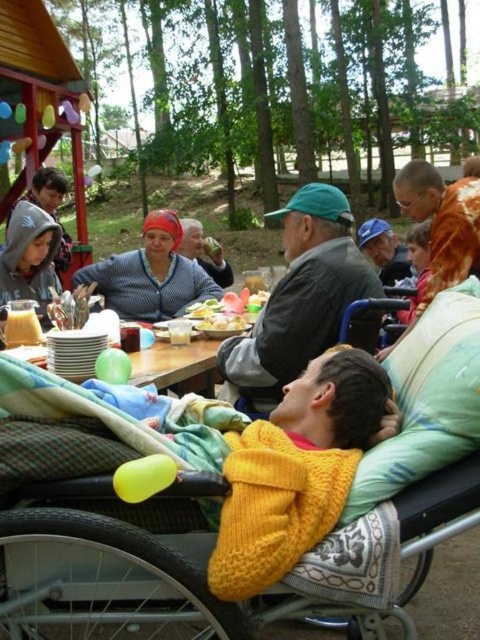
Question: Is green fabric cap at center smaller than matte gray sweater at center?

Choices:
 (A) no
 (B) yes

Answer: (A)

Question: Can you confirm if wooden table at center is positioned to the left of smooth plastic bowl at center?

Choices:
 (A) no
 (B) yes

Answer: (B)

Question: Based on their relative distances, which object is farther from the yellow knitted baby carriage at center?

Choices:
 (A) smooth plastic bowl at center
 (B) matte gray sweater at center
 (C) black plastic wheelchair at center

Answer: (B)

Question: Which point is closer to the camera taking this photo?

Choices:
 (A) (3, 429)
 (B) (32, 241)
 (C) (283, 300)
 (D) (259, 304)

Answer: (A)

Question: Is yellow knitted baby carriage at center to the left of smooth plastic bowl at center from the viewer's perspective?

Choices:
 (A) no
 (B) yes

Answer: (A)

Question: Among these objects, which one is nearest to the camera?

Choices:
 (A) green fabric cap at center
 (B) matte gray hoodie at left

Answer: (A)